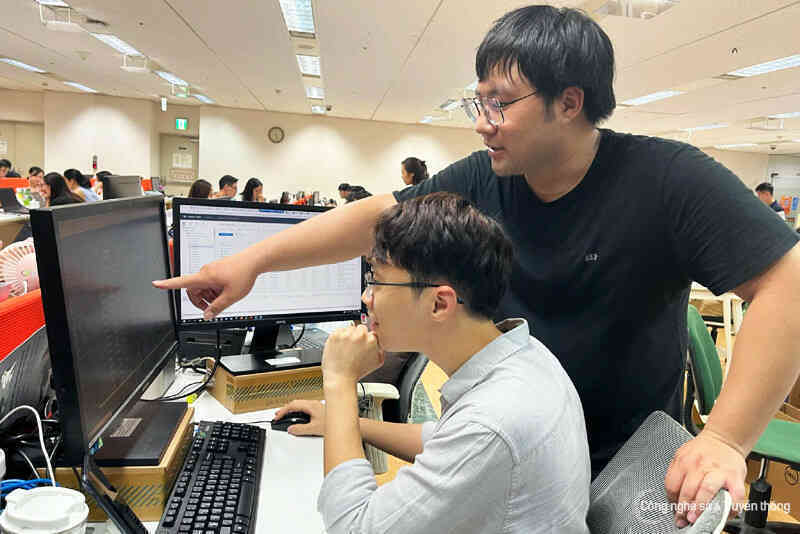
Identify the location of mouse. (278, 423).